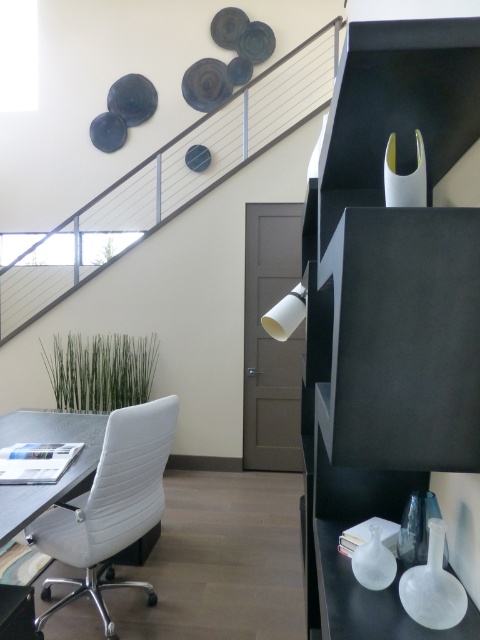
You are an office worker who needs to move a large box from the ground floor to the second floor. The box is 1.2 meters wide. The office has a metallic staircase at upper center and a white leather chair at lower left. Can the box fit through the staircase?

Result: The metallic staircase at upper center is wider than the white leather chair at lower left. Since the box is 1.2 meters wide, it depends on the staircase width. However, the description only states the staircase is wider than the chair, not the exact measurement. Without knowing the chair width, we can not confirm if the staircase is wide enough for the box.

You are standing in the office and see two points marked in the image. Which point is closer to you, point (326, 38) or point (132, 497)?

Point (326, 38) is further to the viewer than point (132, 497), so the closer point to you is point (132, 497).

You are an office worker who needs to reach the second floor. You see a metallic staircase at upper center and a white leather chair at lower left. Which object is closer to the staircase?

The metallic staircase at upper center is positioned over the white leather chair at lower left, so the white leather chair at lower left is directly under the staircase and closer to it.